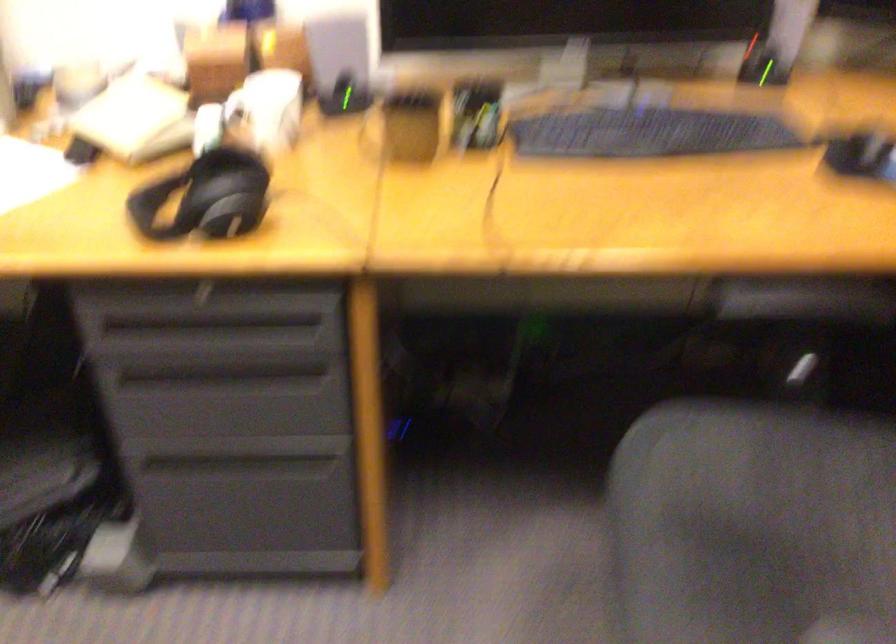
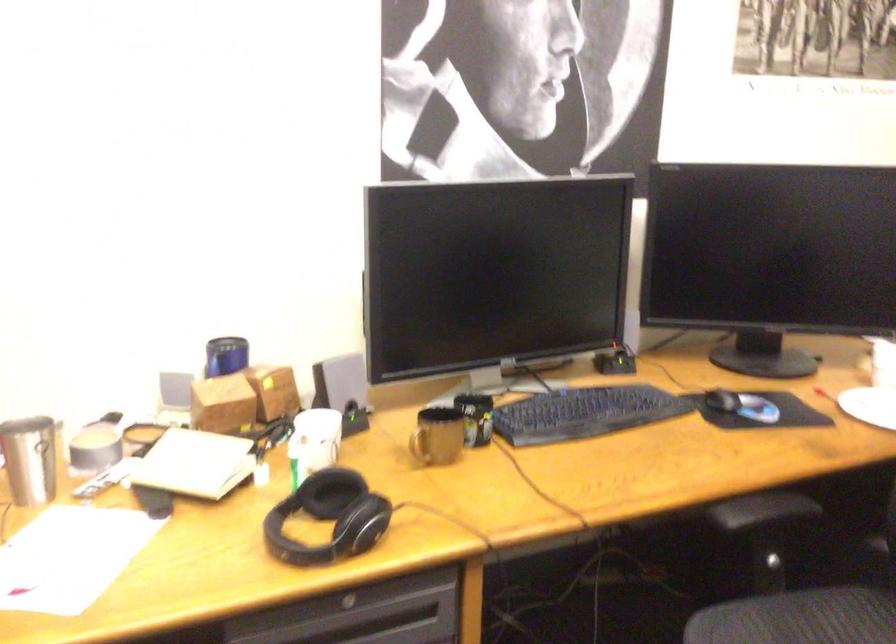
In the second image, find the point that corresponds to point 211,297 in the first image.

(347, 603)